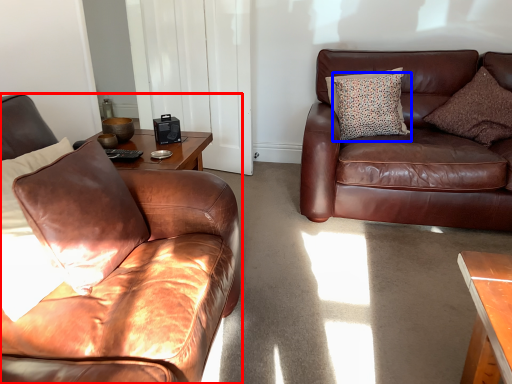
Question: Among these objects, which one is nearest to the camera, studio couch (highlighted by a red box) or pillow (highlighted by a blue box)?

Choices:
 (A) studio couch
 (B) pillow

Answer: (A)